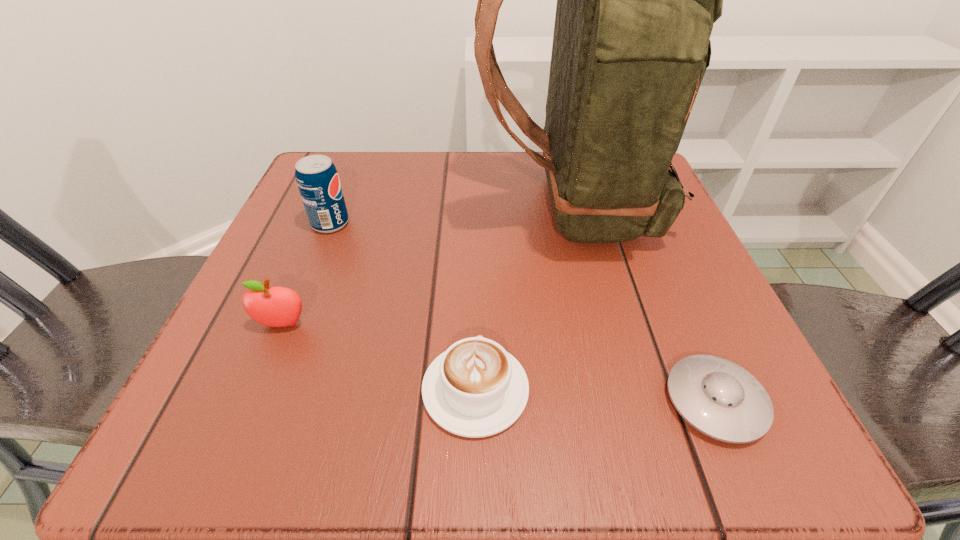
Where is `object that ranks as the fourth closest to the cappuccino`? The height and width of the screenshot is (540, 960). object that ranks as the fourth closest to the cappuccino is located at coordinates (317, 179).

You are a GUI agent. You are given a task and a screenshot of the screen. Output one action in this format:
    pyautogui.click(x=<x>, y=<y>)
    Task: Click on the vacant point that satisfies the following two spatial constraints: 1. on the back of the tallest object; 2. on the left side of the shortest object
    This screenshot has width=960, height=540.
    Given the screenshot: What is the action you would take?
    pyautogui.click(x=618, y=401)

Locate an element on the screen. This screenshot has height=540, width=960. free space in the image that satisfies the following two spatial constraints: 1. on the front side of the third nearest object; 2. on the right side of the saucer is located at coordinates (251, 401).

Locate an element on the screen. This screenshot has height=540, width=960. free space that satisfies the following two spatial constraints: 1. on the front side of the pop; 2. on the left side of the saucer is located at coordinates (259, 401).